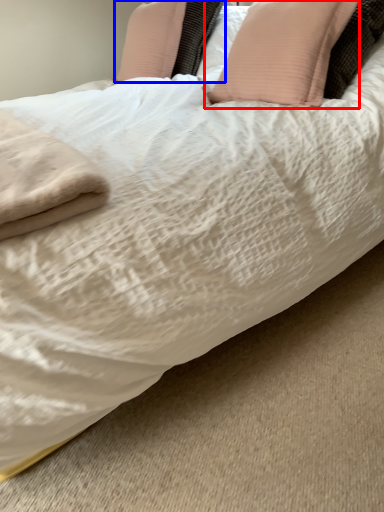
Question: Which point is closer to the camera, pillow (highlighted by a red box) or pillow (highlighted by a blue box)?

Choices:
 (A) pillow
 (B) pillow

Answer: (A)